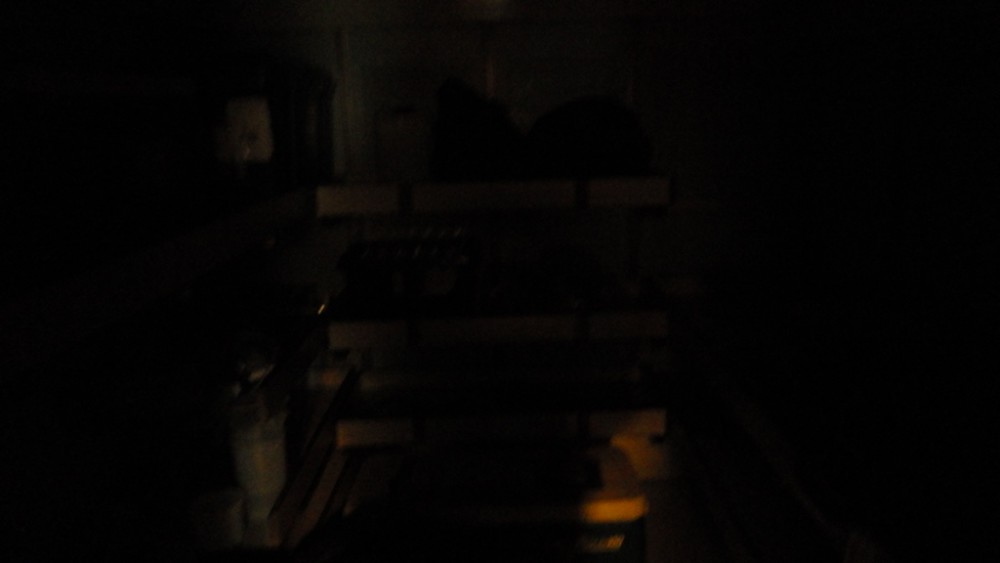
You are a GUI agent. You are given a task and a screenshot of the screen. Output one action in this format:
    pyautogui.click(x=<x>, y=<y>)
    Task: Click on the tray
    This screenshot has width=1000, height=563.
    Given the screenshot: What is the action you would take?
    pyautogui.click(x=262, y=534)